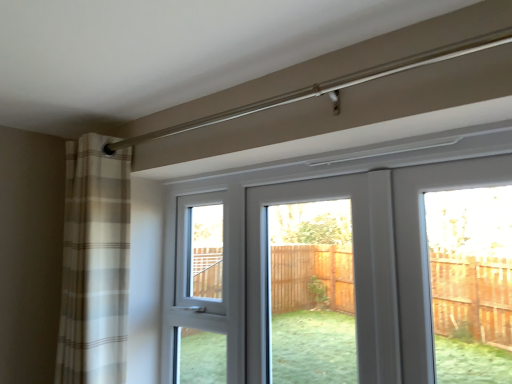
Describe the element at coordinates (267, 262) in the screenshot. This screenshot has width=512, height=384. I see `white plastic screen door at center` at that location.

Describe the element at coordinates (94, 263) in the screenshot. I see `plaid fabric curtain at left` at that location.

You are a GUI agent. You are given a task and a screenshot of the screen. Output one action in this format:
    pyautogui.click(x=<x>, y=<y>)
    Task: Click on the white plastic screen door at center
    
    Given the screenshot: What is the action you would take?
    pyautogui.click(x=267, y=262)

Between point (320, 191) and point (356, 315), which one is positioned behind?

The point (320, 191) is farther.

From the image's perspective, would you say white plastic screen door at center is positioned over white glossy door at center?

Yes, from the image's perspective, white plastic screen door at center is on top of white glossy door at center.

Is white plastic screen door at center not within white glossy door at center?

No.

Considering their positions, is white plastic screen door at center located in front of or behind white glossy door at center?

white plastic screen door at center is behind white glossy door at center.

From the picture: Is white plastic screen door at center with plaid fabric curtain at left?

They are not placed beside each other.

From a real-world perspective, is white plastic screen door at center above or below plaid fabric curtain at left?

From a real-world perspective, white plastic screen door at center is physically below plaid fabric curtain at left.

Looking at this image, between white plastic screen door at center and plaid fabric curtain at left, which one has larger size?

Bigger between the two is plaid fabric curtain at left.

From the image's perspective, which is above, white glossy door at center or plaid fabric curtain at left?

From the image's view, plaid fabric curtain at left is above.

Do you think white glossy door at center is within plaid fabric curtain at left, or outside of it?

white glossy door at center is located beyond the bounds of plaid fabric curtain at left.

From the picture: Can you confirm if white glossy door at center is taller than plaid fabric curtain at left?

No, white glossy door at center is not taller than plaid fabric curtain at left.

Between white glossy door at center and plaid fabric curtain at left, which one has larger width?

A: Wider between the two is plaid fabric curtain at left.

From a real-world perspective, is plaid fabric curtain at left physically located above or below white plastic screen door at center?

Clearly, from a real-world perspective, plaid fabric curtain at left is above white plastic screen door at center.

Is the depth of plaid fabric curtain at left greater than that of white plastic screen door at center?

Yes, the depth of plaid fabric curtain at left is greater than that of white plastic screen door at center.

Can you see plaid fabric curtain at left touching white plastic screen door at center?

No, plaid fabric curtain at left is not touching white plastic screen door at center.

From the image's perspective, which one is positioned lower, plaid fabric curtain at left or white plastic screen door at center?

white plastic screen door at center appears lower in the image.

Considering the sizes of objects white glossy door at center and white plastic screen door at center in the image provided, who is taller, white glossy door at center or white plastic screen door at center?

Standing taller between the two is white plastic screen door at center.

Is white glossy door at center oriented away from white plastic screen door at center?

Yes, white glossy door at center is facing away from white plastic screen door at center.

Is white glossy door at center surrounding white plastic screen door at center?

Indeed, white plastic screen door at center is located within white glossy door at center.

Locate an element on the screen. The width and height of the screenshot is (512, 384). curtain located above the white glossy door at center (from the image's perspective) is located at coordinates (94, 263).

Is plaid fabric curtain at left completely or partially outside of white glossy door at center?

Indeed, plaid fabric curtain at left is completely outside white glossy door at center.

Is plaid fabric curtain at left wider or thinner than white glossy door at center?

Considering their sizes, plaid fabric curtain at left looks broader than white glossy door at center.

Considering the sizes of objects plaid fabric curtain at left and white glossy door at center in the image provided, who is smaller, plaid fabric curtain at left or white glossy door at center?

white glossy door at center is smaller.

The height and width of the screenshot is (384, 512). I want to click on screen door lying behind the white glossy door at center, so click(x=267, y=262).

What are the coordinates of `curtain that appears above the white plastic screen door at center (from the image's perspective)` in the screenshot? It's located at (94, 263).

When comparing their distances from white glossy door at center, does plaid fabric curtain at left or white plastic screen door at center seem further?

plaid fabric curtain at left lies further to white glossy door at center than the other object.

Estimate the real-world distances between objects in this image. Which object is further from plaid fabric curtain at left, white plastic screen door at center or white glossy door at center?

white glossy door at center lies further to plaid fabric curtain at left than the other object.

When comparing their distances from white glossy door at center, does white plastic screen door at center or plaid fabric curtain at left seem closer?

Among the two, white plastic screen door at center is located nearer to white glossy door at center.

Which object lies nearer to the anchor point white plastic screen door at center, plaid fabric curtain at left or white glossy door at center?

Based on the image, plaid fabric curtain at left appears to be nearer to white plastic screen door at center.

From the image, which object appears to be farther from plaid fabric curtain at left, white glossy door at center or white plastic screen door at center?

The object further to plaid fabric curtain at left is white glossy door at center.

Estimate the real-world distances between objects in this image. Which object is further from white plastic screen door at center, white glossy door at center or plaid fabric curtain at left?

white glossy door at center.

Where is `door located between plaid fabric curtain at left and white plastic screen door at center in the left-right direction`? The width and height of the screenshot is (512, 384). door located between plaid fabric curtain at left and white plastic screen door at center in the left-right direction is located at coordinates (341, 272).